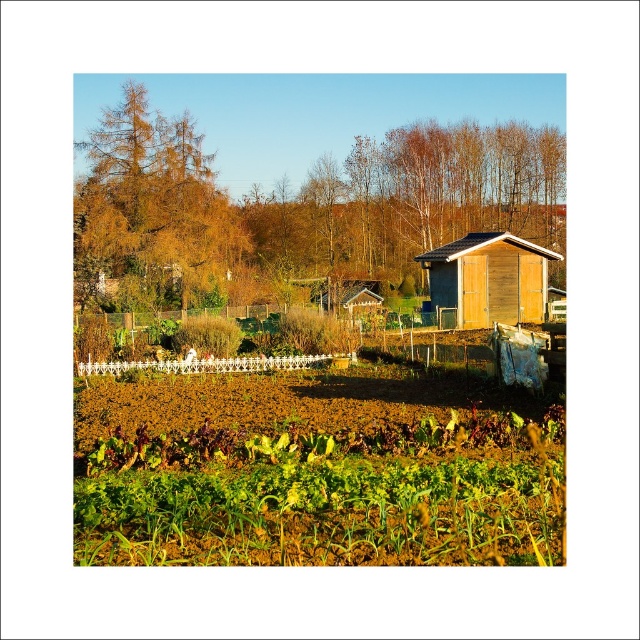
Question: Which of the following is the closest to the observer?

Choices:
 (A) green leafy vegetables at lower center
 (B) wooden shed at center-right

Answer: (A)

Question: Does green leafy vegetables at lower center have a larger size compared to wooden shed at center-right?

Choices:
 (A) yes
 (B) no

Answer: (A)

Question: Can you confirm if green leafy vegetables at lower center is bigger than wooden shed at center-right?

Choices:
 (A) no
 (B) yes

Answer: (B)

Question: Can you confirm if green leafy vegetables at lower center is wider than wooden shed at center-right?

Choices:
 (A) yes
 (B) no

Answer: (A)